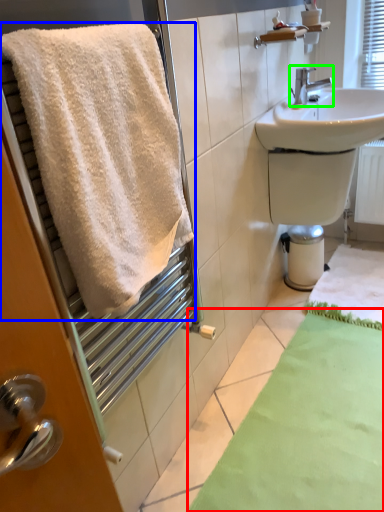
Question: Which object is the closest to the bath mat (highlighted by a red box)? Choose among these: towel (highlighted by a blue box) or tap (highlighted by a green box).

Choices:
 (A) towel
 (B) tap

Answer: (A)